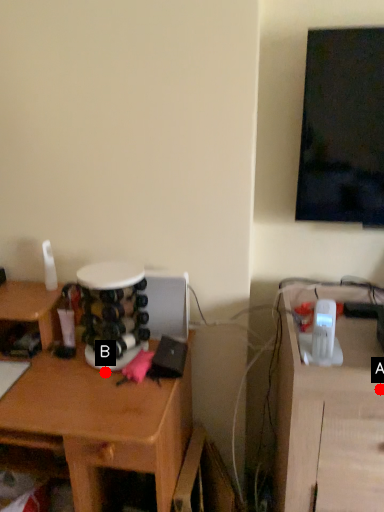
Question: Two points are circled on the image, labeled by A and B beside each circle. Which of the following is the closest to the observer?

Choices:
 (A) A is closer
 (B) B is closer

Answer: (A)